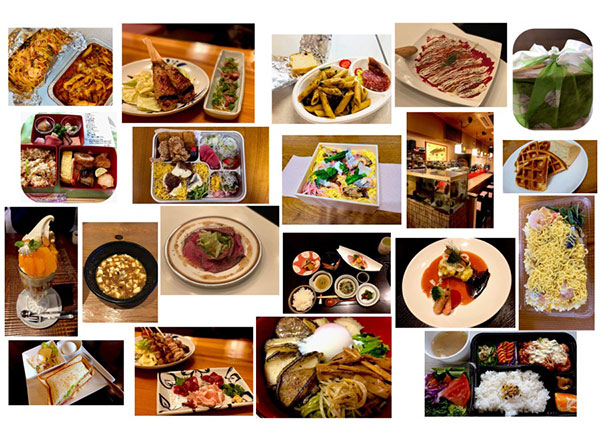
Where is `middle row of dishes`? middle row of dishes is located at coordinates (316, 331), (334, 270), (322, 179), (335, 87).